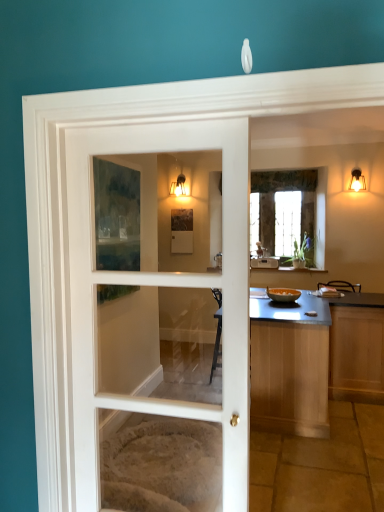
Image resolution: width=384 pixels, height=512 pixels. I want to click on clear glass window at center, so (x=320, y=218).

Identify the location of matte gold light fixture at upper right, which is the 2th light fixture from left to right. (357, 180).

Measure the distance between matte gold light fixture at upper right, the 2th light fixture in the back-to-front sequence, and camera.

The depth of matte gold light fixture at upper right, the 2th light fixture in the back-to-front sequence, is 4.98 meters.

This screenshot has height=512, width=384. Identify the location of smooth wooden countertop at center. (314, 360).

How much distance is there between clear glass window at center and white glass door at center?

clear glass window at center is 13.27 feet away from white glass door at center.

Is clear glass window at center positioned with its back to white glass door at center?

No, clear glass window at center is not facing the opposite direction of white glass door at center.

From the picture: Would you say clear glass window at center is outside white glass door at center?

Yes.

Which of these two, clear glass window at center or white glass door at center, stands shorter?

With less height is clear glass window at center.

Do you think white glass door at center is within clear glass window at center, or outside of it?

white glass door at center is outside clear glass window at center.

Which of these two, white glass door at center or clear glass window at center, is bigger?

clear glass window at center is bigger.

Is white glass door at center looking in the opposite direction of clear glass window at center?

No, white glass door at center's orientation is not away from clear glass window at center.

Does white glass door at center touch clear glass window at center?

white glass door at center and clear glass window at center are not in contact.

Which of these two, matte glass sconce at upper center, the 1th light fixture in the left-to-right sequence, or matte gold light fixture at upper right, the 2th light fixture in the back-to-front sequence, is wider?

matte gold light fixture at upper right, the 2th light fixture in the back-to-front sequence, is wider.

Does point (178, 182) appear closer or farther from the camera than point (352, 173)?

Clearly, point (178, 182) is more distant from the camera than point (352, 173).

Is matte glass sconce at upper center, which is the second light fixture in right-to-left order, positioned far away from matte gold light fixture at upper right, the 2th light fixture in the back-to-front sequence?

matte glass sconce at upper center, which is the second light fixture in right-to-left order, is positioned a significant distance from matte gold light fixture at upper right, the 2th light fixture in the back-to-front sequence.

Which is more to the left, matte glass sconce at upper center, acting as the 2th light fixture starting from the front, or matte gold light fixture at upper right, which is the 2th light fixture from left to right?

From the viewer's perspective, matte glass sconce at upper center, acting as the 2th light fixture starting from the front, appears more on the left side.

From the image's perspective, between smooth wooden countertop at center and clear glass window at center, who is located below?

smooth wooden countertop at center, from the image's perspective.

Is smooth wooden countertop at center facing towards clear glass window at center?

No, smooth wooden countertop at center is not oriented towards clear glass window at center.

Which is further, (370, 311) or (324, 209)?

The point (324, 209) is behind.

From a real-world perspective, who is located higher, smooth wooden countertop at center or clear glass window at center?

clear glass window at center, from a real-world perspective.

From the image's perspective, relative to matte gold light fixture at upper right, the 2th light fixture in the back-to-front sequence, is white glass door at center above or below?

Clearly, from the image's perspective, white glass door at center is below matte gold light fixture at upper right, the 2th light fixture in the back-to-front sequence.

Is white glass door at center outside of matte gold light fixture at upper right, the 2th light fixture in the back-to-front sequence?

Yes, white glass door at center is outside of matte gold light fixture at upper right, the 2th light fixture in the back-to-front sequence.

Can you tell me how much white glass door at center and matte gold light fixture at upper right, the 2th light fixture in the back-to-front sequence, differ in facing direction?

There is a 178-degree angle between the facing directions of white glass door at center and matte gold light fixture at upper right, the 2th light fixture in the back-to-front sequence.

Is white glass door at center positioned behind matte gold light fixture at upper right, the 1th light fixture positioned from the front?

That is False.

From a real-world perspective, is smooth wooden countertop at center located higher than white glass door at center?

No.

Considering the positions of objects smooth wooden countertop at center and white glass door at center in the image provided, who is more to the right, smooth wooden countertop at center or white glass door at center?

From the viewer's perspective, smooth wooden countertop at center appears more on the right side.

Is smooth wooden countertop at center next to white glass door at center and touching it?

No, smooth wooden countertop at center is not with white glass door at center.

Is point (346, 330) in front of point (241, 471)?

No, it is behind (241, 471).

Does white glass door at center have a larger size compared to smooth wooden countertop at center?

No, white glass door at center is not bigger than smooth wooden countertop at center.

Is the position of white glass door at center more distant than that of smooth wooden countertop at center?

No.

Is white glass door at center to the left of smooth wooden countertop at center from the viewer's perspective?

Yes, white glass door at center is to the left of smooth wooden countertop at center.

This screenshot has height=512, width=384. I want to click on door that appears on the left of clear glass window at center, so click(161, 285).

Image resolution: width=384 pixels, height=512 pixels. I want to click on window behind the white glass door at center, so click(x=320, y=218).

Which object lies further to the anchor point clear glass window at center, matte gold light fixture at upper right, which is the 2th light fixture from left to right, or white glass door at center?

Among the two, white glass door at center is located further to clear glass window at center.

Looking at the image, which one is located closer to matte gold light fixture at upper right, the 2th light fixture in the back-to-front sequence, clear glass window at center or smooth wooden countertop at center?

The object closer to matte gold light fixture at upper right, the 2th light fixture in the back-to-front sequence, is clear glass window at center.

From the image, which object appears to be nearer to matte gold light fixture at upper right, which is the 2th light fixture from left to right, matte glass sconce at upper center, acting as the 2th light fixture starting from the front, or clear glass window at center?

Based on the image, clear glass window at center appears to be nearer to matte gold light fixture at upper right, which is the 2th light fixture from left to right.

When comparing their distances from matte gold light fixture at upper right, which is the 2th light fixture from left to right, does clear glass window at center or white glass door at center seem closer?

Among the two, clear glass window at center is located nearer to matte gold light fixture at upper right, which is the 2th light fixture from left to right.

Consider the image. Looking at the image, which one is located further to matte glass sconce at upper center, which is the second light fixture in right-to-left order, white glass door at center or matte gold light fixture at upper right, which is the 2th light fixture from left to right?

white glass door at center is further to matte glass sconce at upper center, which is the second light fixture in right-to-left order.

When comparing their distances from smooth wooden countertop at center, does matte gold light fixture at upper right, which is the 2th light fixture from left to right, or clear glass window at center seem further?

matte gold light fixture at upper right, which is the 2th light fixture from left to right, lies further to smooth wooden countertop at center than the other object.

Looking at the image, which one is located closer to white glass door at center, matte glass sconce at upper center, which is the second light fixture in right-to-left order, or matte gold light fixture at upper right, which is the 2th light fixture from left to right?

Based on the image, matte glass sconce at upper center, which is the second light fixture in right-to-left order, appears to be nearer to white glass door at center.

Based on their spatial positions, is matte gold light fixture at upper right, the 1th light fixture viewed from the right, or clear glass window at center closer to matte glass sconce at upper center, acting as the 2th light fixture starting from the front?

Based on the image, clear glass window at center appears to be nearer to matte glass sconce at upper center, acting as the 2th light fixture starting from the front.

At what (x,y) coordinates should I click in order to perform the action: click on light fixture between smooth wooden countertop at center and matte glass sconce at upper center, arranged as the 1th light fixture when viewed from the back, from front to back. Please return your answer as a coordinate pair (x, y). The height and width of the screenshot is (512, 384). Looking at the image, I should click on (357, 180).

Identify the location of countertop between white glass door at center and matte glass sconce at upper center, acting as the 2th light fixture starting from the front, along the z-axis. This screenshot has height=512, width=384. (314, 360).

Locate an element on the screen. This screenshot has height=512, width=384. countertop between white glass door at center and clear glass window at center from front to back is located at coordinates (314, 360).

Locate an element on the screen. Image resolution: width=384 pixels, height=512 pixels. countertop positioned between white glass door at center and matte gold light fixture at upper right, the 1th light fixture positioned from the front, from near to far is located at coordinates (314, 360).